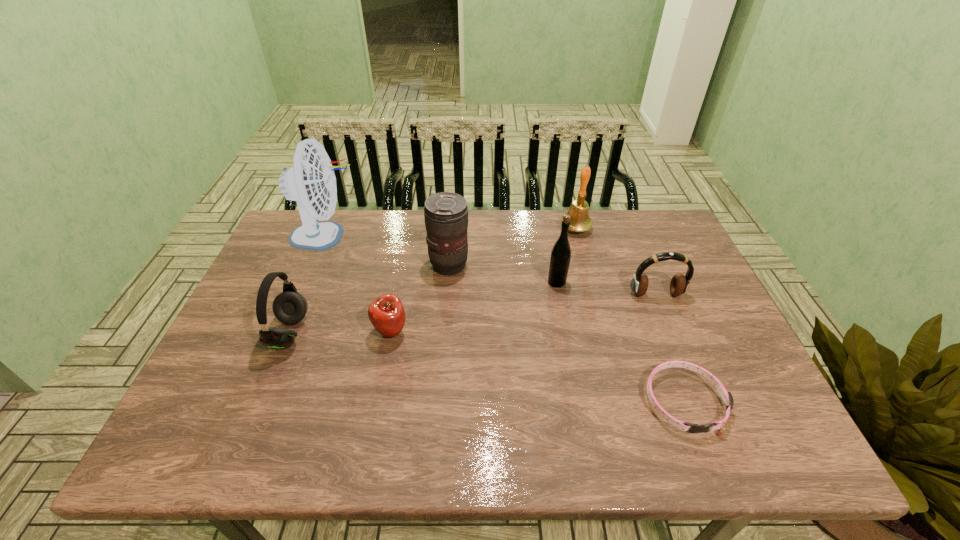
I want to click on the shortest object, so click(727, 397).

The image size is (960, 540). What are the coordinates of `dog collar` in the screenshot? It's located at (727, 397).

This screenshot has height=540, width=960. What are the coordinates of `free location located 0.050m on the grille of the tallest object` in the screenshot? It's located at (376, 237).

This screenshot has width=960, height=540. I want to click on free region located on the front of the sixth object from left to right, so click(x=596, y=306).

Where is `vacant region located on the left of the beer bottle`? The width and height of the screenshot is (960, 540). vacant region located on the left of the beer bottle is located at coordinates (453, 282).

You are a GUI agent. You are given a task and a screenshot of the screen. Output one action in this format:
    pyautogui.click(x=<x>, y=<y>)
    Task: Click on the free space located on the side of the fourth object from left to right where the control switches are located
    This screenshot has width=960, height=540.
    Given the screenshot: What is the action you would take?
    pyautogui.click(x=565, y=265)

You are a GUI agent. You are given a task and a screenshot of the screen. Output one action in this format:
    pyautogui.click(x=<x>, y=<y>)
    Task: Click on the blank space located on the ear cups of the left headset
    Image resolution: width=960 pixels, height=540 pixels.
    Given the screenshot: What is the action you would take?
    pyautogui.click(x=415, y=333)

Find the location of a particular element. Image resolution: width=960 pixels, height=540 pixels. vacant region located on the ear cup of the shorter headset is located at coordinates (675, 341).

Locate an element on the screen. This screenshot has width=960, height=540. free space located on the back of the third object from left to right is located at coordinates (411, 228).

Locate an element on the screen. This screenshot has width=960, height=540. fan at the far edge is located at coordinates (311, 181).